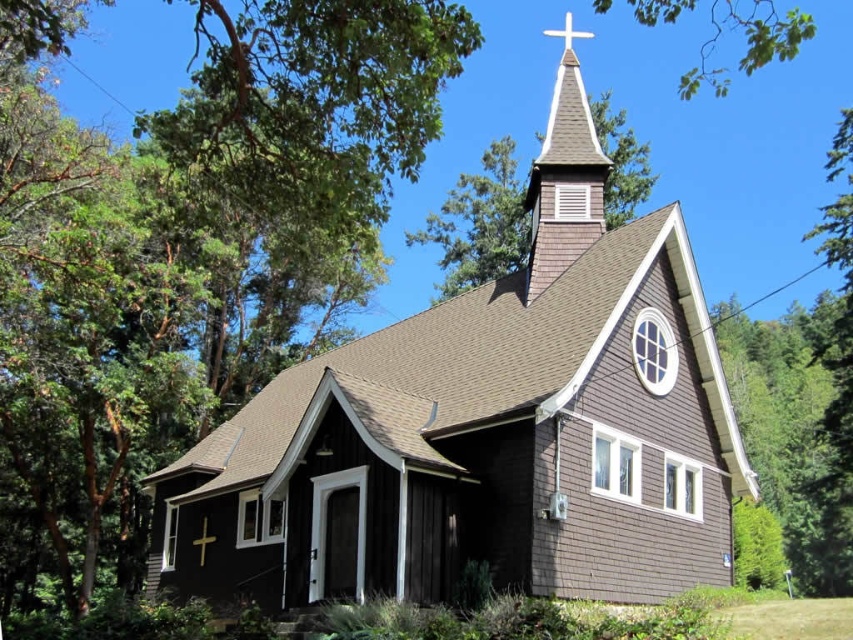
Question: Does white wooden cross at upper center have a smaller size compared to gold metallic cross at center?

Choices:
 (A) no
 (B) yes

Answer: (A)

Question: Which of these objects is positioned farthest from the brown shingles at upper center?

Choices:
 (A) brown shingles church at center
 (B) gold metallic cross at center

Answer: (B)

Question: Does brown shingles church at center appear over gold metallic cross at center?

Choices:
 (A) yes
 (B) no

Answer: (A)

Question: Is brown shingles church at center thinner than brown shingles at upper center?

Choices:
 (A) yes
 (B) no

Answer: (B)

Question: Which object appears farthest from the camera in this image?

Choices:
 (A) brown shingles at upper center
 (B) white wooden cross at upper center
 (C) brown shingles church at center

Answer: (B)

Question: Which of the following is the farthest from the observer?

Choices:
 (A) brown shingles at upper center
 (B) brown shingles church at center
 (C) white wooden cross at upper center

Answer: (C)